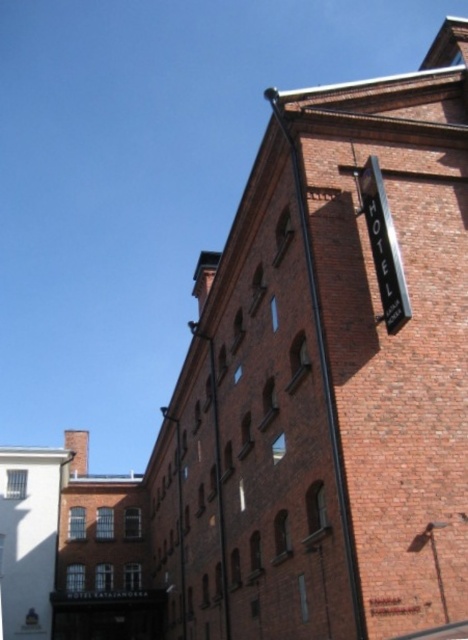
Question: Which is farther from the black plastic hotel sign at upper right?

Choices:
 (A) metallic signboard at upper right
 (B) smooth metal pole at center

Answer: (B)

Question: Does metallic signboard at upper right come behind smooth metal pole at center?

Choices:
 (A) yes
 (B) no

Answer: (B)

Question: Based on their relative distances, which object is farther from the black plastic hotel sign at upper right?

Choices:
 (A) smooth metal pole at center
 (B) metallic signboard at upper right

Answer: (A)

Question: From the image, what is the correct spatial relationship of metallic signboard at upper right in relation to black plastic hotel sign at upper right?

Choices:
 (A) below
 (B) above

Answer: (B)

Question: Does metallic signboard at upper right have a smaller size compared to smooth metal pole at center?

Choices:
 (A) no
 (B) yes

Answer: (A)

Question: Estimate the real-world distances between objects in this image. Which object is closer to the metallic signboard at upper right?

Choices:
 (A) black plastic hotel sign at upper right
 (B) smooth metal pole at center

Answer: (A)